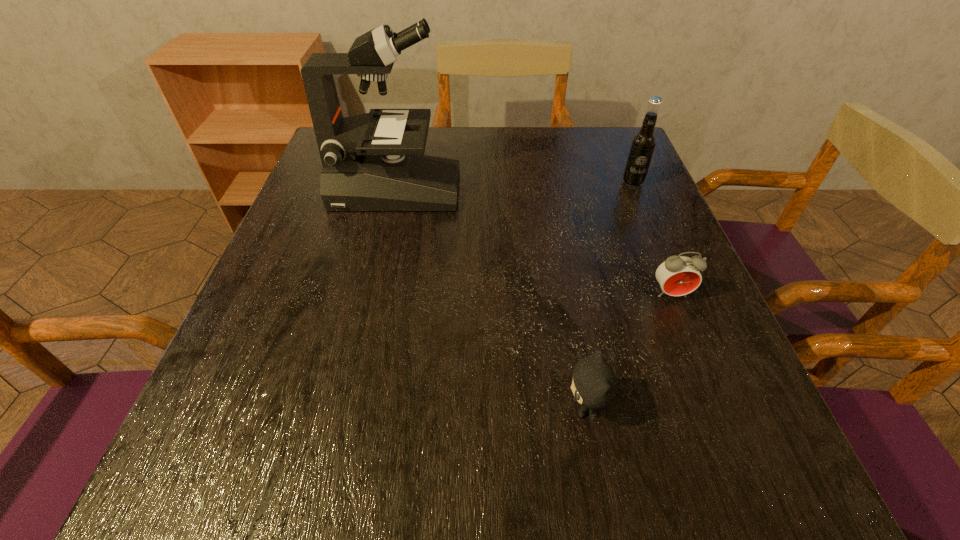
Locate an element on the screen. vacant area situated on the front-facing side of the kitten is located at coordinates (518, 408).

Where is `vacant point located 0.400m on the front-facing side of the kitten`? The width and height of the screenshot is (960, 540). vacant point located 0.400m on the front-facing side of the kitten is located at coordinates (298, 408).

This screenshot has height=540, width=960. I want to click on object that is at the far edge, so click(375, 161).

Identify the location of object present at the left edge. (375, 161).

Where is `root beer located in the right edge section of the desktop`? The height and width of the screenshot is (540, 960). root beer located in the right edge section of the desktop is located at coordinates (642, 147).

The image size is (960, 540). In order to click on alarm clock located at the right edge in this screenshot , I will do `click(678, 275)`.

I want to click on object located at the far left corner, so click(375, 161).

Find the location of a particular element. This screenshot has width=960, height=540. free space at the far edge of the desktop is located at coordinates (461, 172).

This screenshot has width=960, height=540. In the image, there is a desktop. In order to click on vacant space at the near edge in this screenshot , I will do `click(566, 465)`.

Image resolution: width=960 pixels, height=540 pixels. I want to click on free spot at the left edge of the desktop, so click(x=273, y=364).